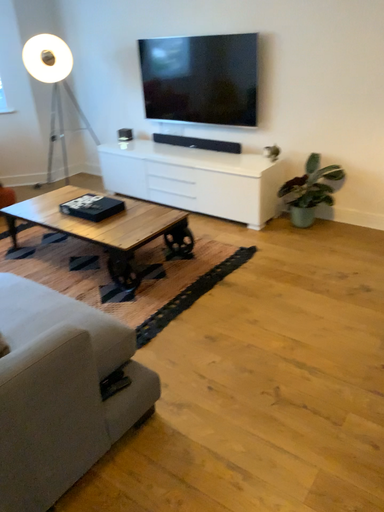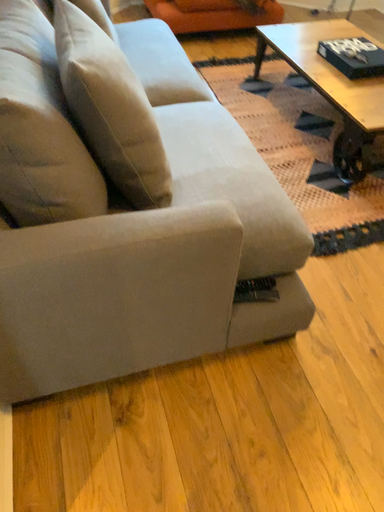
Question: Which way did the camera rotate in the video?

Choices:
 (A) rotated right
 (B) rotated left

Answer: (B)